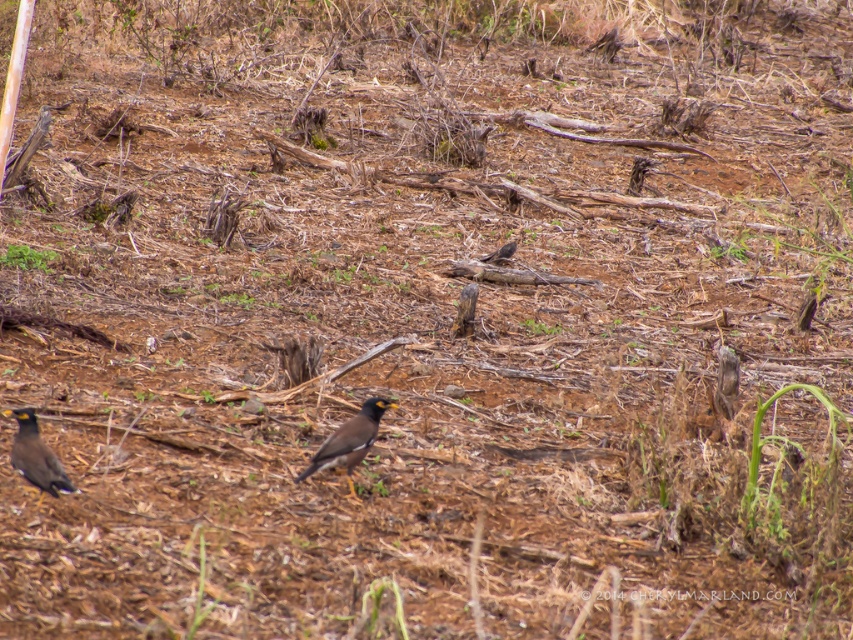
How distant is brown speckled feathers at center from brown matte bird at center?

brown speckled feathers at center and brown matte bird at center are 14.00 feet apart.

Which of these two, brown speckled feathers at center or brown matte bird at center, stands taller?

brown speckled feathers at center

Which is behind, point (325, 456) or point (491, 256)?

Positioned behind is point (491, 256).

Locate an element on the screen. This screenshot has height=640, width=853. brown speckled feathers at center is located at coordinates (349, 440).

Is shiny black bird at center smaller than brown matte bird at center?

Actually, shiny black bird at center might be larger than brown matte bird at center.

Can you confirm if shiny black bird at center is thinner than brown matte bird at center?

No, shiny black bird at center is not thinner than brown matte bird at center.

Between point (28, 416) and point (485, 257), which one is positioned in front?

Point (28, 416)

Where is `shiny black bird at center`? This screenshot has width=853, height=640. shiny black bird at center is located at coordinates (35, 456).

Looking at this image, who is more distant from viewer, (346,470) or (57,477)?

Point (346,470)

Does brown speckled feathers at center have a lesser width compared to shiny black bird at center?

Incorrect, brown speckled feathers at center's width is not less than shiny black bird at center's.

Who is more forward, (358, 422) or (18, 435)?

Point (18, 435)

Image resolution: width=853 pixels, height=640 pixels. Identify the location of brown speckled feathers at center. (349, 440).